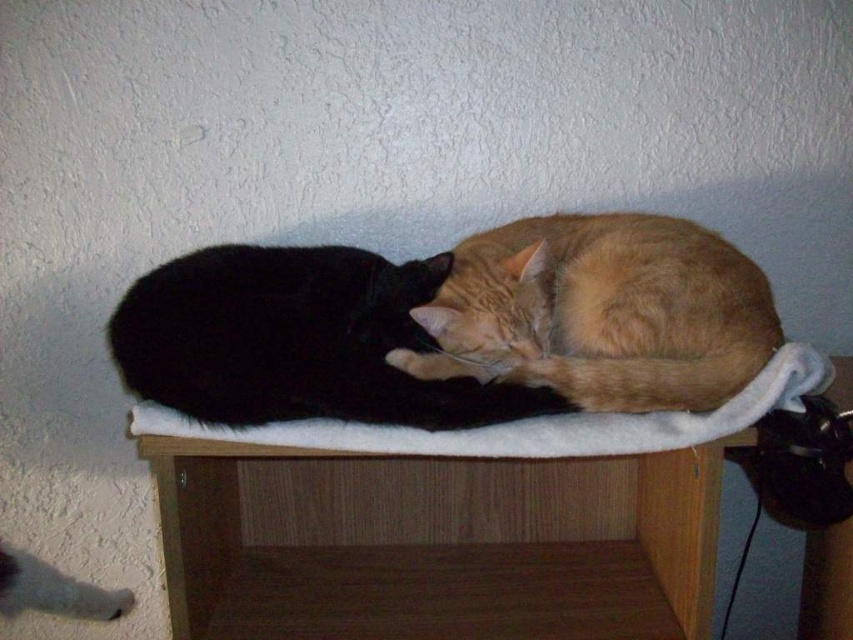
Between orange fur cat at center and white soft cat bed at center, which one appears on the right side from the viewer's perspective?

From the viewer's perspective, orange fur cat at center appears more on the right side.

Where is `orange fur cat at center`? The image size is (853, 640). orange fur cat at center is located at coordinates (602, 312).

Find the location of a particular element. orange fur cat at center is located at coordinates (602, 312).

Can you confirm if orange fur cat at center is smaller than black fur cat at center?

Incorrect, orange fur cat at center is not smaller in size than black fur cat at center.

Does orange fur cat at center have a larger size compared to black fur cat at center?

Correct, orange fur cat at center is larger in size than black fur cat at center.

Image resolution: width=853 pixels, height=640 pixels. I want to click on orange fur cat at center, so click(x=602, y=312).

Is black fur cat at center bigger than white soft cat bed at center?

Correct, black fur cat at center is larger in size than white soft cat bed at center.

Does point (312, 396) lie in front of point (596, 413)?

Yes.

Is point (131, 362) positioned in front of point (488, 452)?

No.

This screenshot has width=853, height=640. I want to click on black fur cat at center, so click(297, 340).